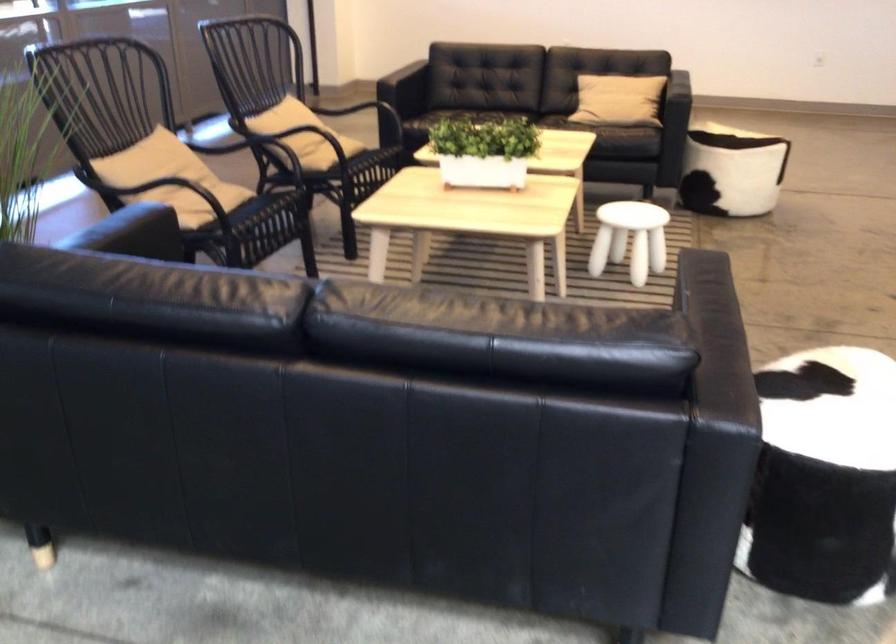
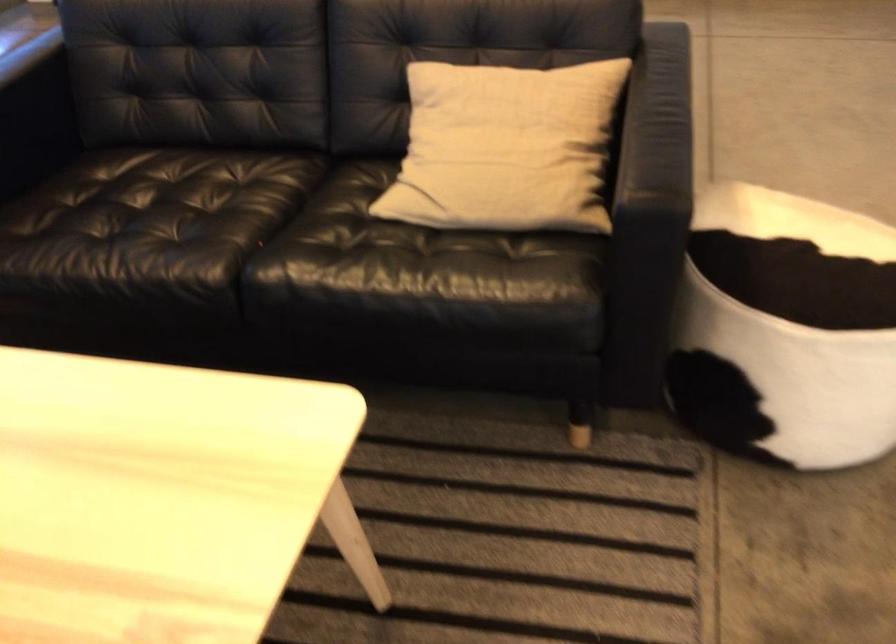
Locate, in the second image, the point that corresponds to point 647,84 in the first image.

(505, 147)